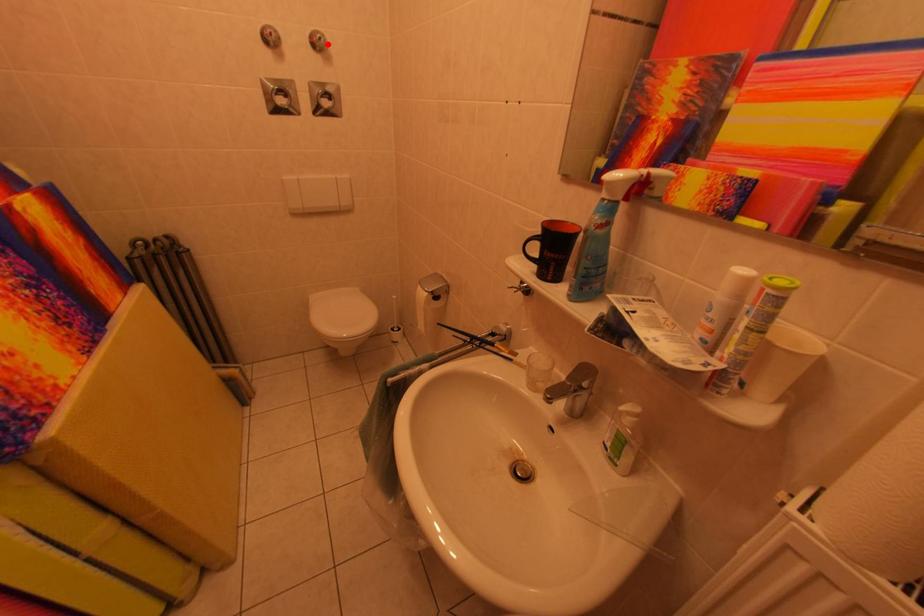
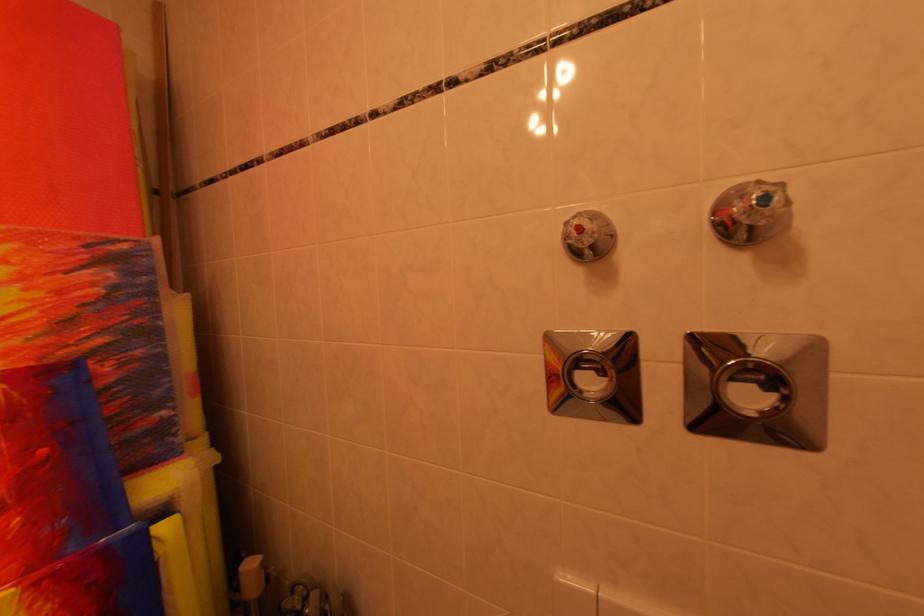
Find the pixel in the second image that matches the highlighted location in the first image.

(773, 201)